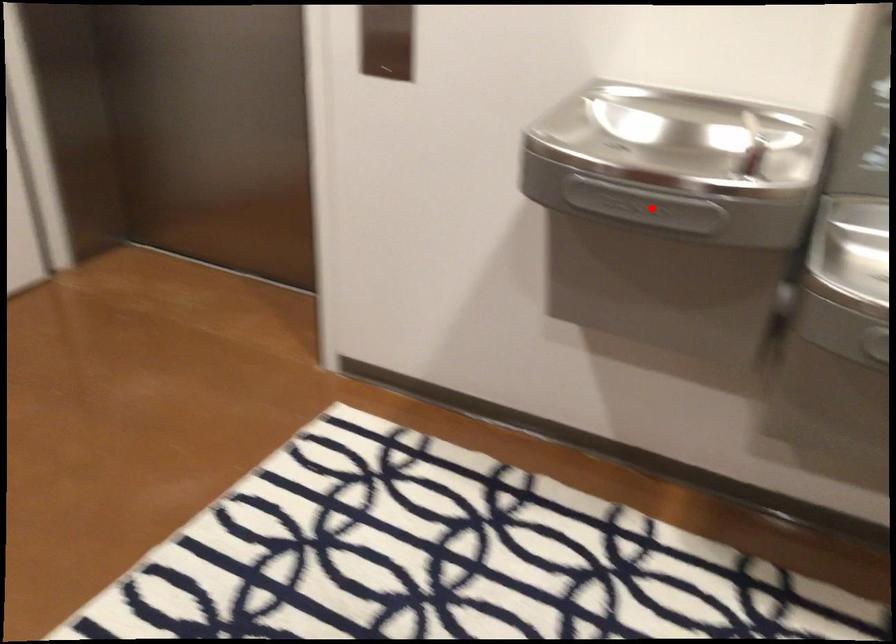
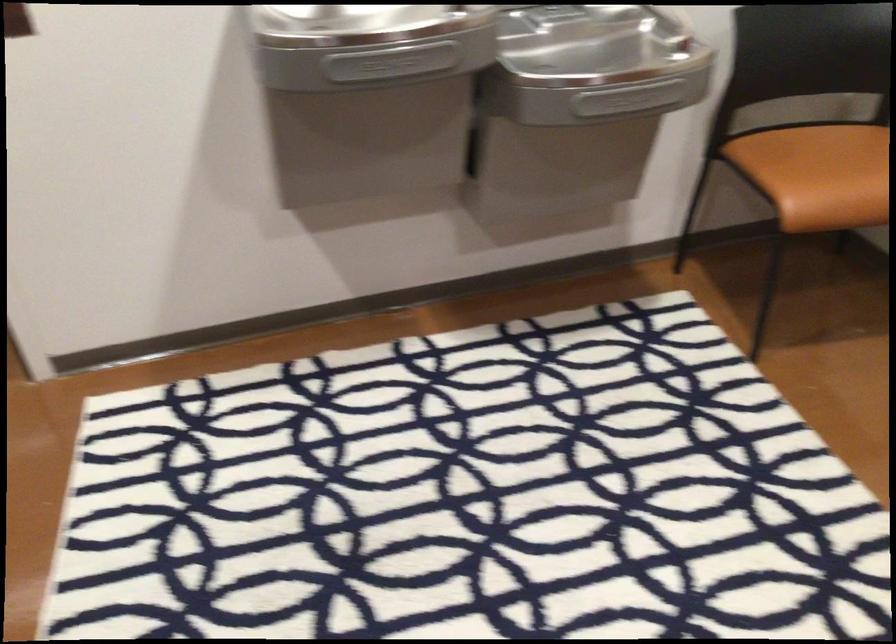
In the second image, find the point that corresponds to the highlighted location in the first image.

(391, 62)